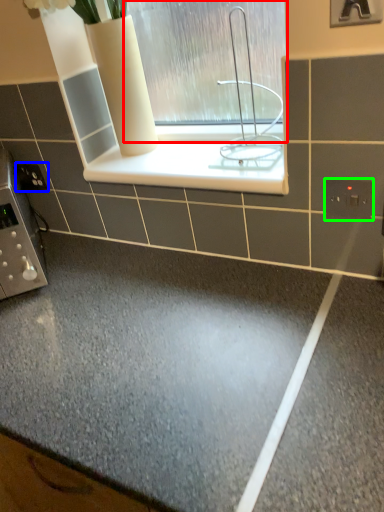
Question: Estimate the real-world distances between objects in this image. Which object is closer to window (highlighted by a red box), electric outlet (highlighted by a blue box) or electric outlet (highlighted by a green box)?

Choices:
 (A) electric outlet
 (B) electric outlet

Answer: (B)